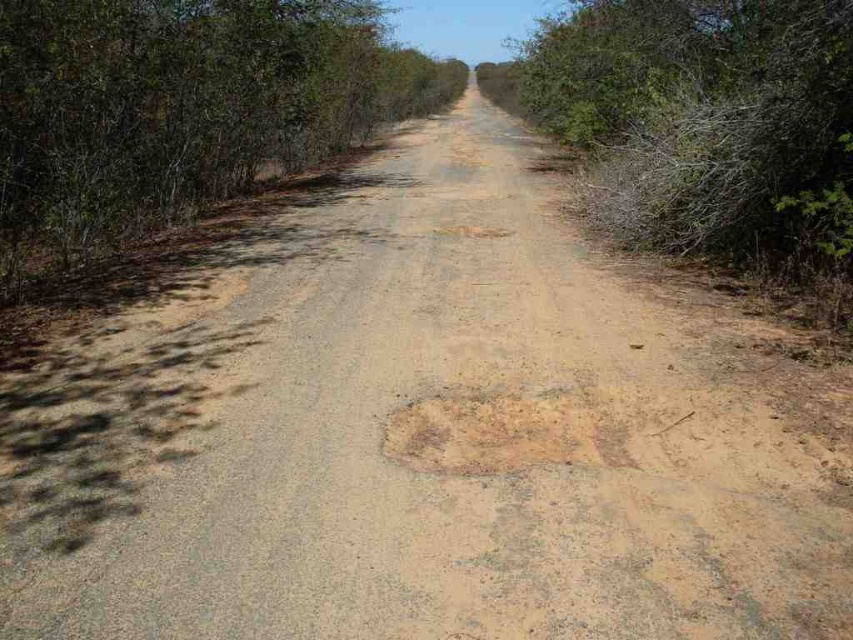
Question: Considering the real-world distances, which object is farthest from the brown textured patch at center?

Choices:
 (A) green leafy bush at left
 (B) green leafy bush at right

Answer: (A)

Question: Based on their relative distances, which object is farther from the green leafy bush at right?

Choices:
 (A) brown textured patch at center
 (B) green leafy bush at left

Answer: (B)

Question: Is green leafy bush at left to the left of brown textured patch at center from the viewer's perspective?

Choices:
 (A) no
 (B) yes

Answer: (B)

Question: Considering the relative positions of green leafy bush at left and brown textured patch at center in the image provided, where is green leafy bush at left located with respect to brown textured patch at center?

Choices:
 (A) below
 (B) above

Answer: (B)

Question: Among these points, which one is nearest to the camera?

Choices:
 (A) (666, 77)
 (B) (331, 52)

Answer: (A)

Question: Is the position of green leafy bush at left more distant than that of brown textured patch at center?

Choices:
 (A) no
 (B) yes

Answer: (B)